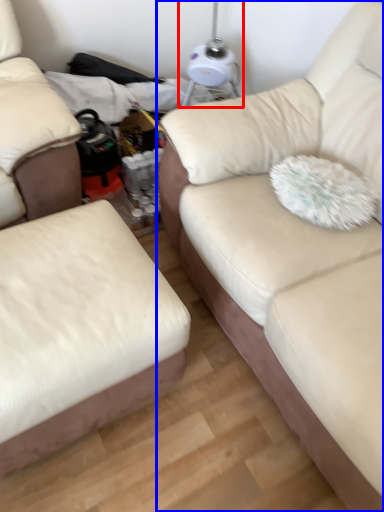
Question: Which of the following is the closest to the observer, table lamp (highlighted by a red box) or studio couch (highlighted by a blue box)?

Choices:
 (A) table lamp
 (B) studio couch

Answer: (B)